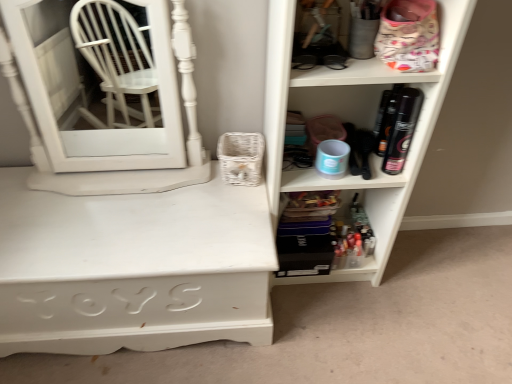
Question: Is translucent plastic containers at lower center, which is counted as the second shelf, starting from the top, outside white painted wood desk at lower left?

Choices:
 (A) yes
 (B) no

Answer: (A)

Question: Considering the relative sizes of translucent plastic containers at lower center, marked as the 1th shelf in a bottom-to-top arrangement, and white painted wood desk at lower left in the image provided, is translucent plastic containers at lower center, marked as the 1th shelf in a bottom-to-top arrangement, bigger than white painted wood desk at lower left?

Choices:
 (A) no
 (B) yes

Answer: (A)

Question: Can you confirm if translucent plastic containers at lower center, which is counted as the second shelf, starting from the top, is shorter than white painted wood desk at lower left?

Choices:
 (A) no
 (B) yes

Answer: (B)

Question: From the image's perspective, is translucent plastic containers at lower center, which is counted as the second shelf, starting from the top, on white painted wood desk at lower left?

Choices:
 (A) no
 (B) yes

Answer: (B)

Question: Can white painted wood desk at lower left be found inside translucent plastic containers at lower center, marked as the 1th shelf in a bottom-to-top arrangement?

Choices:
 (A) no
 (B) yes

Answer: (A)

Question: From the image's perspective, relative to white painted wood desk at lower left, is translucent plastic containers at lower center, which is counted as the second shelf, starting from the top, above or below?

Choices:
 (A) above
 (B) below

Answer: (A)

Question: In terms of size, does translucent plastic containers at lower center, marked as the 1th shelf in a bottom-to-top arrangement, appear bigger or smaller than white painted wood desk at lower left?

Choices:
 (A) small
 (B) big

Answer: (A)

Question: Considering the positions of point (365, 205) and point (125, 279), is point (365, 205) closer or farther from the camera than point (125, 279)?

Choices:
 (A) farther
 (B) closer

Answer: (A)

Question: From their relative heights in the image, would you say translucent plastic containers at lower center, marked as the 1th shelf in a bottom-to-top arrangement, is taller or shorter than white painted wood desk at lower left?

Choices:
 (A) short
 (B) tall

Answer: (A)

Question: Looking at the image, does translucent plastic containers at lower center, which is counted as the second shelf, starting from the top, seem bigger or smaller compared to white glossy medicine cabinet at left?

Choices:
 (A) small
 (B) big

Answer: (A)

Question: From a real-world perspective, is translucent plastic containers at lower center, which is counted as the second shelf, starting from the top, physically located above or below white glossy medicine cabinet at left?

Choices:
 (A) above
 (B) below

Answer: (B)

Question: Is translucent plastic containers at lower center, which is counted as the second shelf, starting from the top, in front of or behind white glossy medicine cabinet at left in the image?

Choices:
 (A) front
 (B) behind

Answer: (B)

Question: Is translucent plastic containers at lower center, which is counted as the second shelf, starting from the top, situated inside white glossy medicine cabinet at left or outside?

Choices:
 (A) inside
 (B) outside

Answer: (B)

Question: From a real-world perspective, is translucent plastic containers at lower center, which is counted as the second shelf, starting from the top, above or below matte white shelf at right, which ranks as the 2th shelf in bottom-to-top order?

Choices:
 (A) above
 (B) below

Answer: (B)

Question: In terms of height, does translucent plastic containers at lower center, which is counted as the second shelf, starting from the top, look taller or shorter compared to matte white shelf at right, placed as the 1th shelf when sorted from top to bottom?

Choices:
 (A) tall
 (B) short

Answer: (B)